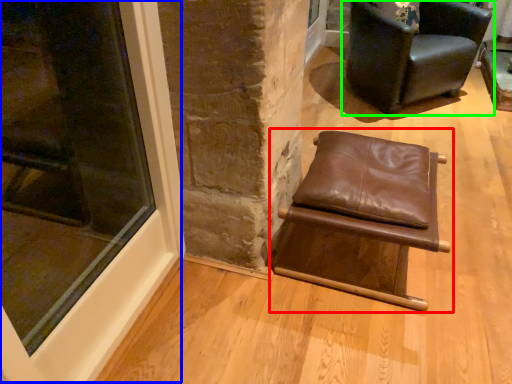
Question: Which object is positioned farthest from chair (highlighted by a red box)? Select from window (highlighted by a blue box) and chair (highlighted by a green box).

Choices:
 (A) window
 (B) chair

Answer: (B)